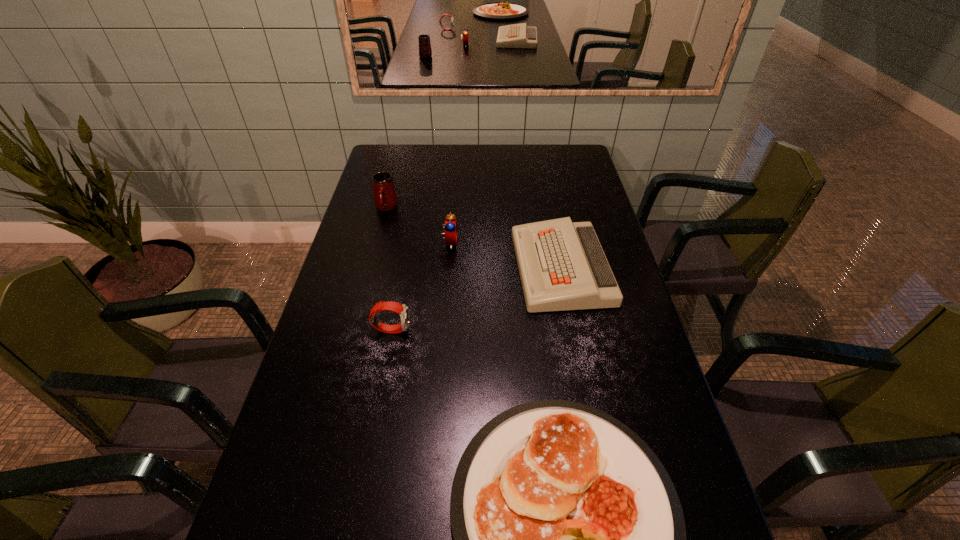
Where is `blank region between the third object from right to left and the watch`? Image resolution: width=960 pixels, height=540 pixels. blank region between the third object from right to left and the watch is located at coordinates (420, 286).

The width and height of the screenshot is (960, 540). I want to click on vacant space in between the fourth object from right to left and the computer keyboard, so click(x=476, y=299).

At what (x,y) coordinates should I click in order to perform the action: click on free space between the watch and the third object from right to left. Please return your answer as a coordinate pair (x, y). This screenshot has width=960, height=540. Looking at the image, I should click on (420, 286).

Locate an element on the screen. free point between the farthest object and the computer keyboard is located at coordinates (473, 238).

Select which object appears as the closest to the computer keyboard. Please provide its 2D coordinates. Your answer should be formatted as a tuple, i.e. [(x, y)], where the tuple contains the x and y coordinates of a point satisfying the conditions above.

[(450, 224)]

Where is `object that can be found as the third closest to the third tallest object`? The height and width of the screenshot is (540, 960). object that can be found as the third closest to the third tallest object is located at coordinates (x=450, y=224).

Find the location of a particular element. vacant space that satisfies the following two spatial constraints: 1. on the front-facing side of the computer keyboard; 2. on the left side of the third object from left to right is located at coordinates (447, 268).

Find the location of a particular element. vacant region that satisfies the following two spatial constraints: 1. on the front-facing side of the third object from left to right; 2. on the left side of the computer keyboard is located at coordinates (447, 268).

You are a GUI agent. You are given a task and a screenshot of the screen. Output one action in this format:
    pyautogui.click(x=<x>, y=<y>)
    Task: Click on the vacant space that satisfies the following two spatial constraints: 1. on the side of the leftmost object with the handle; 2. on the right side of the fourth tallest object
    This screenshot has height=540, width=960.
    Given the screenshot: What is the action you would take?
    pyautogui.click(x=371, y=268)

What are the coordinates of `free space in the image that satisfies the following two spatial constraints: 1. on the back side of the second shortest object; 2. on the front-facing side of the third object from left to right` in the screenshot? It's located at click(x=557, y=242).